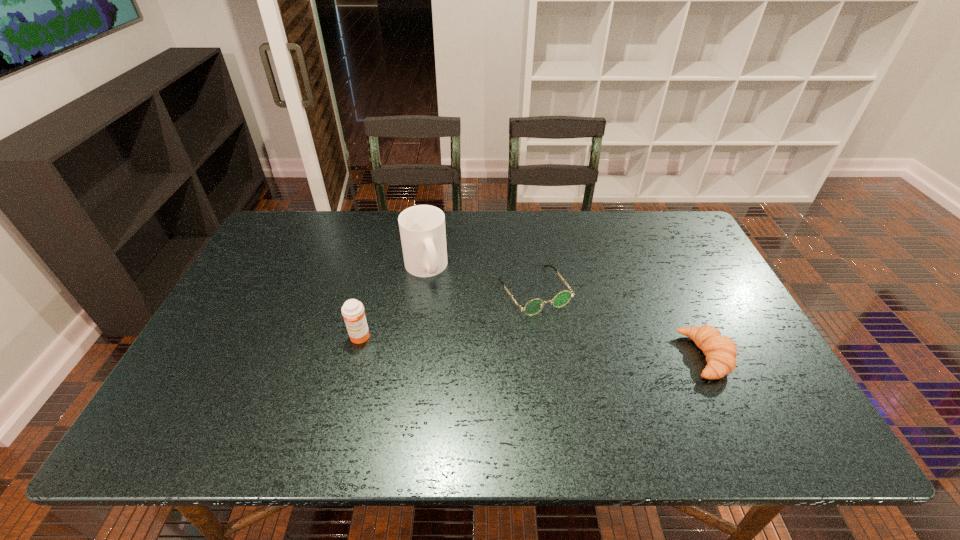
Identify the location of vacant space located 0.270m on the handle side of the tallest object. (480, 348).

Find the location of a particular element. The image size is (960, 540). vacant space situated 0.110m on the lenses of the third object from left to right is located at coordinates (572, 346).

Locate an element on the screen. vacant area situated on the lenses of the third object from left to right is located at coordinates (595, 381).

You are a GUI agent. You are given a task and a screenshot of the screen. Output one action in this format:
    pyautogui.click(x=<x>, y=<y>)
    Task: Click on the blank space located 0.090m on the lenses of the third object from left to right
    The image size is (960, 540).
    Given the screenshot: What is the action you would take?
    pyautogui.click(x=567, y=341)

Where is `object at the far edge`? This screenshot has width=960, height=540. object at the far edge is located at coordinates coord(422,228).

In order to click on object located in the near edge section of the desktop in this screenshot , I will do point(720,351).

Identify the location of object present at the right edge. (720, 351).

Locate an element on the screen. The image size is (960, 540). object that is at the near right corner is located at coordinates (720, 351).

The width and height of the screenshot is (960, 540). Find the location of `vacant space at the far edge of the desktop`. vacant space at the far edge of the desktop is located at coordinates (453, 214).

The width and height of the screenshot is (960, 540). In the image, there is a desktop. In order to click on blank space at the near edge in this screenshot , I will do `click(429, 386)`.